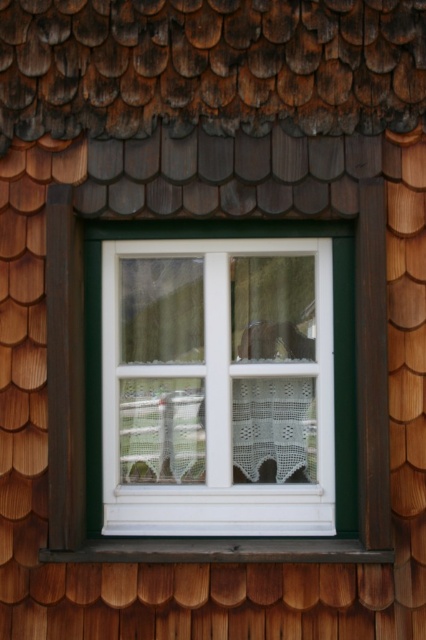
Can you confirm if white plastic window at center is taller than dark wood at bottom?

Indeed, white plastic window at center has a greater height compared to dark wood at bottom.

Between white plastic window at center and dark wood at bottom, which one appears on the left side from the viewer's perspective?

dark wood at bottom is more to the left.

Between point (242, 509) and point (201, 541), which one is positioned behind?

Positioned behind is point (242, 509).

The width and height of the screenshot is (426, 640). Identify the location of white plastic window at center. (218, 387).